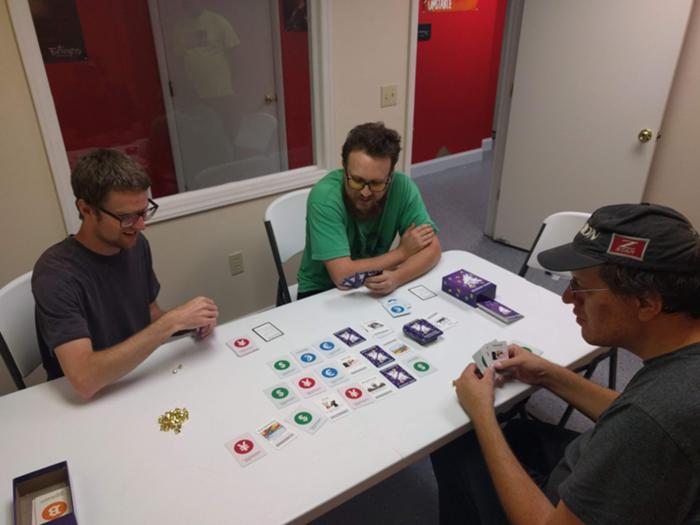
Locate an element on the screen. picture hanging on wall is located at coordinates (297, 13), (71, 38).